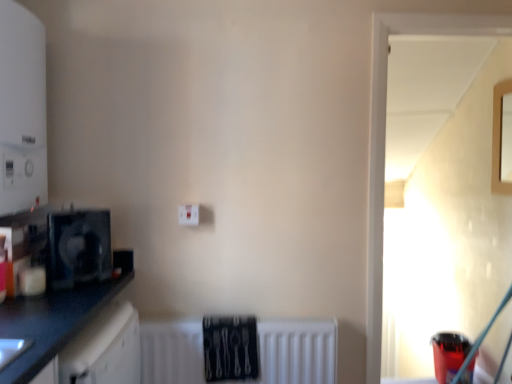
Question: From the image's perspective, is white matte radiator at lower center below transparent glass door at upper right, the first window from the left?

Choices:
 (A) no
 (B) yes

Answer: (B)

Question: Is white matte radiator at lower center completely or partially outside of transparent glass door at upper right, which is counted as the 2th window, starting from the right?

Choices:
 (A) no
 (B) yes

Answer: (B)

Question: Would you say white matte radiator at lower center contains transparent glass door at upper right, arranged as the first window when viewed from the front?

Choices:
 (A) yes
 (B) no

Answer: (B)

Question: From a real-world perspective, is white matte radiator at lower center on top of transparent glass door at upper right, placed as the 2th window when sorted from back to front?

Choices:
 (A) no
 (B) yes

Answer: (A)

Question: Considering the relative sizes of white matte radiator at lower center and transparent glass door at upper right, which is counted as the 2th window, starting from the right, in the image provided, is white matte radiator at lower center thinner than transparent glass door at upper right, which is counted as the 2th window, starting from the right,?

Choices:
 (A) yes
 (B) no

Answer: (A)

Question: Considering the relative sizes of white matte radiator at lower center and transparent glass door at upper right, placed as the 2th window when sorted from back to front, in the image provided, is white matte radiator at lower center wider than transparent glass door at upper right, placed as the 2th window when sorted from back to front,?

Choices:
 (A) yes
 (B) no

Answer: (B)

Question: Is translucent plastic cup at lower right, which ranks as the second appliance in front-to-back order, completely or partially inside transparent glass door at upper right, arranged as the first window when viewed from the front?

Choices:
 (A) yes
 (B) no

Answer: (B)

Question: Is transparent glass door at upper right, placed as the 2th window when sorted from back to front, next to translucent plastic cup at lower right, acting as the 1th appliance starting from the back?

Choices:
 (A) yes
 (B) no

Answer: (B)

Question: Is translucent plastic cup at lower right, which is the 2th appliance in left-to-right order, at the back of transparent glass door at upper right, placed as the 2th window when sorted from back to front?

Choices:
 (A) no
 (B) yes

Answer: (B)

Question: Can you confirm if transparent glass door at upper right, placed as the 2th window when sorted from back to front, is shorter than translucent plastic cup at lower right, acting as the 1th appliance starting from the back?

Choices:
 (A) no
 (B) yes

Answer: (A)

Question: Is the depth of transparent glass door at upper right, the first window from the left, less than that of translucent plastic cup at lower right, the 2th appliance viewed from the top?

Choices:
 (A) yes
 (B) no

Answer: (A)

Question: Is transparent glass door at upper right, which is counted as the 2th window, starting from the right, thinner than translucent plastic cup at lower right, the 2th appliance viewed from the top?

Choices:
 (A) yes
 (B) no

Answer: (A)

Question: Considering the relative sizes of black plastic fan at left, the 1th appliance in the left-to-right sequence, and white matte radiator at lower center in the image provided, is black plastic fan at left, the 1th appliance in the left-to-right sequence, bigger than white matte radiator at lower center?

Choices:
 (A) no
 (B) yes

Answer: (A)